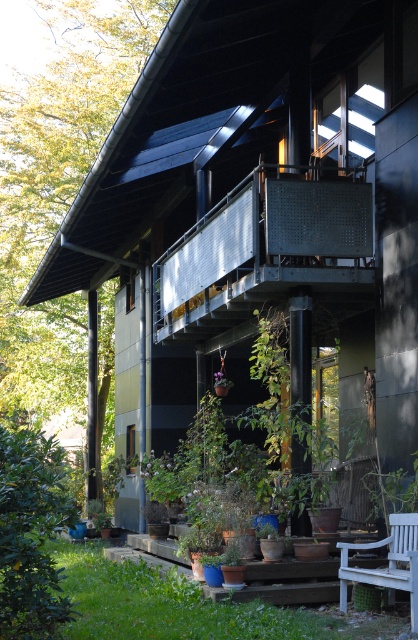
Does green leafy plant at lower left come in front of white wooden bench at lower right?

Yes, it is.

The width and height of the screenshot is (418, 640). I want to click on green leafy plant at lower left, so click(30, 534).

The height and width of the screenshot is (640, 418). Find the location of `green leafy plant at lower left`. green leafy plant at lower left is located at coordinates (30, 534).

Can you confirm if rusty metal balcony at upper center is positioned to the left of white wooden bench at lower right?

Yes, rusty metal balcony at upper center is to the left of white wooden bench at lower right.

Which of these two, rusty metal balcony at upper center or white wooden bench at lower right, stands shorter?

Standing shorter between the two is white wooden bench at lower right.

What do you see at coordinates (264, 250) in the screenshot? The height and width of the screenshot is (640, 418). I see `rusty metal balcony at upper center` at bounding box center [264, 250].

This screenshot has width=418, height=640. I want to click on rusty metal balcony at upper center, so point(264,250).

Based on the photo, does rusty metal balcony at upper center have a lesser width compared to green leafy plant at lower left?

Correct, rusty metal balcony at upper center's width is less than green leafy plant at lower left's.

Is point (259, 180) closer to viewer compared to point (32, 582)?

No, (259, 180) is further to viewer.

Image resolution: width=418 pixels, height=640 pixels. I want to click on rusty metal balcony at upper center, so click(x=264, y=250).